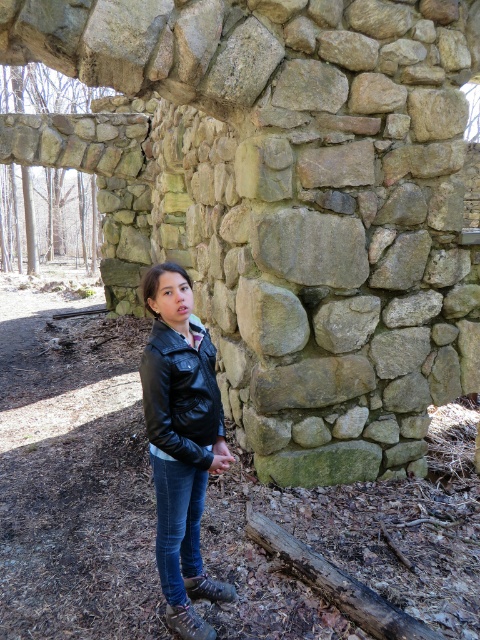
Between black leather jacket at center and brown rough wood at lower center, which one is positioned lower?

brown rough wood at lower center is lower down.

Does black leather jacket at center appear over brown rough wood at lower center?

Indeed, black leather jacket at center is positioned over brown rough wood at lower center.

Is point (159, 492) farther from viewer compared to point (314, 577)?

No, it is not.

Find the location of `black leather jacket at center`. black leather jacket at center is located at coordinates (180, 442).

Is black leather jacket at lower left below denim at lower center?

Incorrect, black leather jacket at lower left is not positioned below denim at lower center.

This screenshot has width=480, height=640. What do you see at coordinates (180, 394) in the screenshot?
I see `black leather jacket at lower left` at bounding box center [180, 394].

Is point (204, 397) positioned after point (169, 458)?

That is True.

This screenshot has height=640, width=480. Find the location of `black leather jacket at lower left`. black leather jacket at lower left is located at coordinates (180, 394).

Does black leather jacket at center appear over black leather jacket at lower left?

Incorrect, black leather jacket at center is not positioned above black leather jacket at lower left.

Is black leather jacket at center wider than black leather jacket at lower left?

Yes.

The height and width of the screenshot is (640, 480). Find the location of `black leather jacket at center`. black leather jacket at center is located at coordinates tap(180, 442).